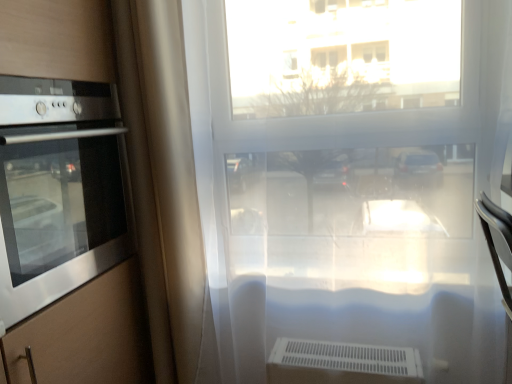
What do you see at coordinates (175, 186) in the screenshot? I see `beige fabric curtain at left` at bounding box center [175, 186].

The width and height of the screenshot is (512, 384). In order to click on stainless steel oven at left in this screenshot , I will do `click(58, 190)`.

Would you say stainless steel oven at left is to the left or to the right of beige fabric curtain at left in the picture?

Based on their positions, stainless steel oven at left is located to the left of beige fabric curtain at left.

Is point (59, 271) closer or farther from the camera than point (175, 212)?

Point (59, 271) is closer to the camera than point (175, 212).

How many degrees apart are the facing directions of stainless steel oven at left and beige fabric curtain at left?

The facing directions of stainless steel oven at left and beige fabric curtain at left are 90 degrees apart.

Does stainless steel oven at left have a lesser height compared to beige fabric curtain at left?

Indeed, stainless steel oven at left has a lesser height compared to beige fabric curtain at left.

Considering the sizes of objects beige fabric curtain at left and transparent plastic window at center in the image provided, who is bigger, beige fabric curtain at left or transparent plastic window at center?

Bigger between the two is transparent plastic window at center.

Based on the photo, from a real-world perspective, is beige fabric curtain at left physically below transparent plastic window at center?

No, from a real-world perspective, beige fabric curtain at left is not under transparent plastic window at center.

Considering the relative sizes of beige fabric curtain at left and transparent plastic window at center in the image provided, is beige fabric curtain at left taller than transparent plastic window at center?

Incorrect, the height of beige fabric curtain at left is not larger of that of transparent plastic window at center.

Is beige fabric curtain at left in front of transparent plastic window at center?

No, the depth of beige fabric curtain at left is greater than that of transparent plastic window at center.

Is point (68, 163) closer to camera compared to point (196, 100)?

Yes, point (68, 163) is in front of point (196, 100).

Between stainless steel oven at left and transparent plastic window at center, which one has smaller size?

Smaller between the two is stainless steel oven at left.

This screenshot has height=384, width=512. I want to click on home appliance that is on the left side of transparent plastic window at center, so click(x=58, y=190).

Based on the photo, from a real-world perspective, which is physically above, stainless steel oven at left or transparent plastic window at center?

stainless steel oven at left.

Image resolution: width=512 pixels, height=384 pixels. I want to click on window frame below the stainless steel oven at left (from a real-world perspective), so click(x=350, y=180).

Is transparent plastic window at center located outside stainless steel oven at left?

Yes, transparent plastic window at center is outside of stainless steel oven at left.

From a real-world perspective, is transparent plastic window at center positioned above or below stainless steel oven at left?

transparent plastic window at center is below stainless steel oven at left.

Which of these two, transparent plastic window at center or stainless steel oven at left, is thinner?

Thinner between the two is transparent plastic window at center.

Which is more to the right, transparent plastic window at center or beige fabric curtain at left?

From the viewer's perspective, transparent plastic window at center appears more on the right side.

Is transparent plastic window at center completely or partially outside of beige fabric curtain at left?

Indeed, transparent plastic window at center is completely outside beige fabric curtain at left.

Who is taller, transparent plastic window at center or beige fabric curtain at left?

transparent plastic window at center is taller.

Are beige fabric curtain at left and stainless steel oven at left making contact?

There is a gap between beige fabric curtain at left and stainless steel oven at left.

Who is smaller, beige fabric curtain at left or stainless steel oven at left?

Smaller between the two is beige fabric curtain at left.

Consider the image. Is beige fabric curtain at left positioned with its back to stainless steel oven at left?

That's not correct — beige fabric curtain at left is not looking away from stainless steel oven at left.

How different are the orientations of beige fabric curtain at left and stainless steel oven at left in degrees?

The facing directions of beige fabric curtain at left and stainless steel oven at left are 90 degrees apart.

The width and height of the screenshot is (512, 384). What are the coordinates of `curtain lying behind the stainless steel oven at left` in the screenshot? It's located at (175, 186).

I want to click on curtain on the left side of transparent plastic window at center, so click(x=175, y=186).

Considering their positions, is beige fabric curtain at left positioned closer to stainless steel oven at left than transparent plastic window at center?

beige fabric curtain at left lies closer to stainless steel oven at left than the other object.

From the image, which object appears to be nearer to transparent plastic window at center, stainless steel oven at left or beige fabric curtain at left?

beige fabric curtain at left is closer to transparent plastic window at center.

Which object lies nearer to the anchor point beige fabric curtain at left, stainless steel oven at left or transparent plastic window at center?

stainless steel oven at left.

Which object lies nearer to the anchor point beige fabric curtain at left, transparent plastic window at center or stainless steel oven at left?

Based on the image, stainless steel oven at left appears to be nearer to beige fabric curtain at left.

Considering their positions, is beige fabric curtain at left positioned further to transparent plastic window at center than stainless steel oven at left?

Among the two, stainless steel oven at left is located further to transparent plastic window at center.

Estimate the real-world distances between objects in this image. Which object is closer to stainless steel oven at left, transparent plastic window at center or beige fabric curtain at left?

Among the two, beige fabric curtain at left is located nearer to stainless steel oven at left.

The width and height of the screenshot is (512, 384). In order to click on curtain located between stainless steel oven at left and transparent plastic window at center in the left-right direction in this screenshot , I will do `click(175, 186)`.